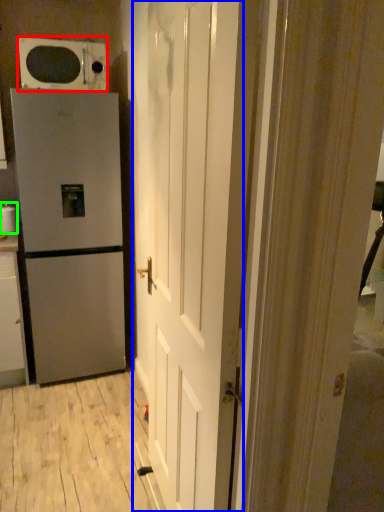
Question: Considering the real-world distances, which object is closest to microwave oven (highlighted by a red box)? door (highlighted by a blue box) or appliance (highlighted by a green box).

Choices:
 (A) door
 (B) appliance

Answer: (B)